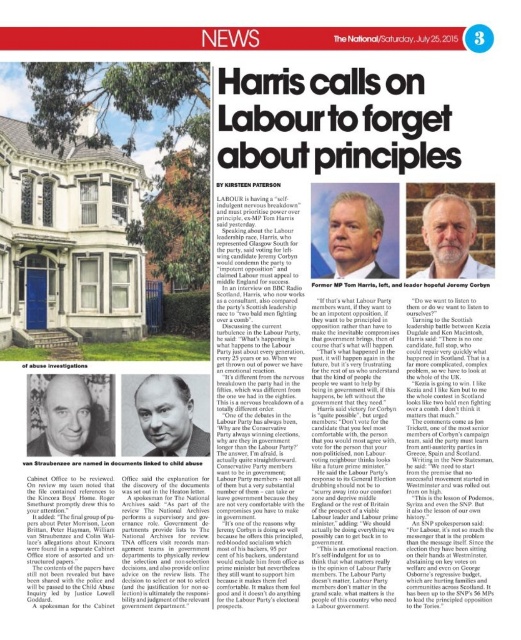
Question: Which point is closer to the camera?

Choices:
 (A) pyautogui.click(x=343, y=225)
 (B) pyautogui.click(x=195, y=445)
 (C) pyautogui.click(x=80, y=380)

Answer: (B)

Question: Among these points, which one is farthest from the camera?

Choices:
 (A) (415, 275)
 (B) (367, 225)
 (C) (110, 444)
 (D) (173, 451)

Answer: (B)

Question: Does smooth black hair at center have a lesser width compared to gray hair man at center?

Choices:
 (A) no
 (B) yes

Answer: (A)

Question: Can you confirm if smooth black hair at center is positioned to the left of gray beard at upper center?

Choices:
 (A) yes
 (B) no

Answer: (A)

Question: Which point is closer to the camera?

Choices:
 (A) gray hair man at center
 (B) gray beard at upper center
 (C) matte black portrait at center

Answer: (B)

Question: Can you confirm if matte black portrait at center is thinner than gray beard at upper center?

Choices:
 (A) no
 (B) yes

Answer: (B)